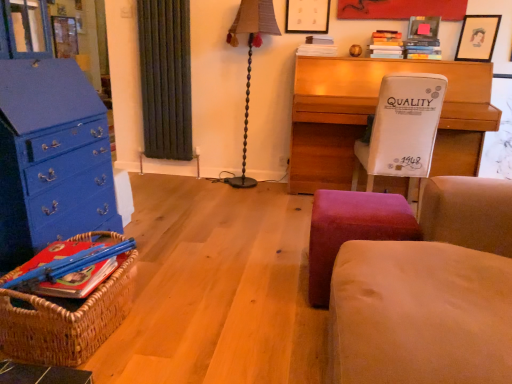
Question: Is wooden desk at center wider than matte black picture frame at upper center, which ranks as the first picture frame in left-to-right order?

Choices:
 (A) no
 (B) yes

Answer: (B)

Question: Are wooden desk at center and matte black picture frame at upper center, which ranks as the first picture frame in left-to-right order, far apart?

Choices:
 (A) yes
 (B) no

Answer: (B)

Question: Is wooden desk at center directly adjacent to matte black picture frame at upper center, which ranks as the first picture frame in left-to-right order?

Choices:
 (A) no
 (B) yes

Answer: (A)

Question: Is wooden desk at center aimed at matte black picture frame at upper center, the 3th picture frame from the right?

Choices:
 (A) no
 (B) yes

Answer: (A)

Question: Is wooden desk at center oriented away from matte black picture frame at upper center, which ranks as the first picture frame in left-to-right order?

Choices:
 (A) no
 (B) yes

Answer: (A)

Question: Is matte black picture frame at upper right, acting as the 2th picture frame starting from the left, spatially inside velvet red stool at lower center, or outside of it?

Choices:
 (A) outside
 (B) inside

Answer: (A)

Question: From a real-world perspective, relative to velvet red stool at lower center, is matte black picture frame at upper right, acting as the 2th picture frame starting from the left, vertically above or below?

Choices:
 (A) below
 (B) above

Answer: (B)

Question: From the image's perspective, relative to velvet red stool at lower center, is matte black picture frame at upper right, arranged as the second picture frame when viewed from the right, above or below?

Choices:
 (A) above
 (B) below

Answer: (A)

Question: Is point (418, 28) positioned closer to the camera than point (352, 216)?

Choices:
 (A) farther
 (B) closer

Answer: (A)

Question: From the image's perspective, is wooden desk at center above or below velvet red stool at lower center?

Choices:
 (A) below
 (B) above

Answer: (B)

Question: Based on their sizes in the image, would you say wooden desk at center is bigger or smaller than velvet red stool at lower center?

Choices:
 (A) big
 (B) small

Answer: (A)

Question: Considering the positions of point (498, 109) and point (313, 226), is point (498, 109) closer or farther from the camera than point (313, 226)?

Choices:
 (A) farther
 (B) closer

Answer: (A)

Question: In the image, is wooden desk at center positioned in front of or behind velvet red stool at lower center?

Choices:
 (A) front
 (B) behind

Answer: (B)

Question: Looking at their shapes, would you say matte black picture frame at upper center, which ranks as the first picture frame in left-to-right order, is wider or thinner than beige fabric rocking chair at right?

Choices:
 (A) thin
 (B) wide

Answer: (A)

Question: Looking at the image, does matte black picture frame at upper center, the 3th picture frame from the right, seem bigger or smaller compared to beige fabric rocking chair at right?

Choices:
 (A) small
 (B) big

Answer: (A)